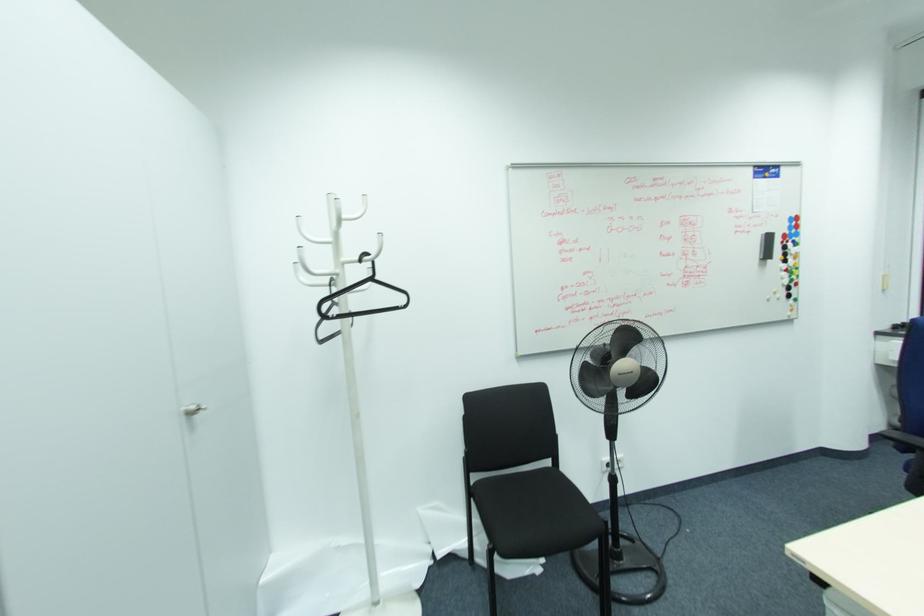
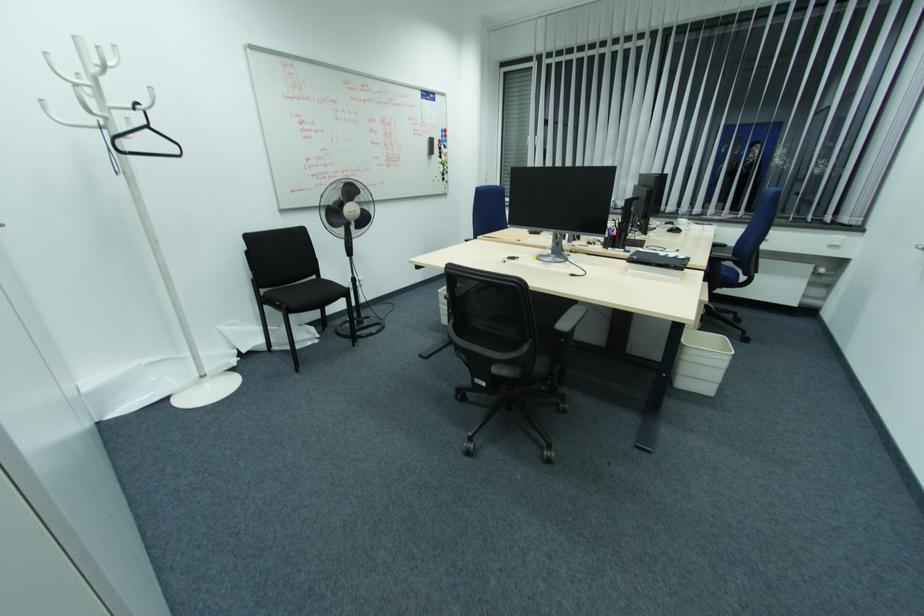
Where in the second image is the point corresponding to pixel 796 238 from the first image?

(445, 144)